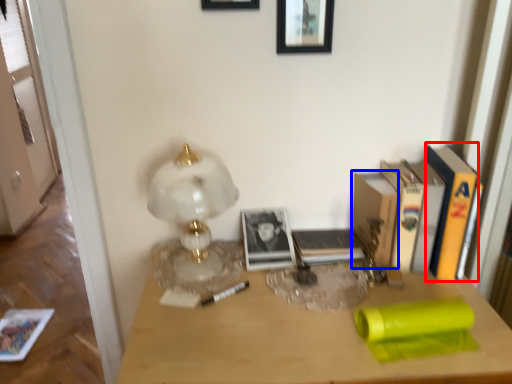
Question: Which of the following is the closest to the observer, paperback book (highlighted by a red box) or paperback book (highlighted by a blue box)?

Choices:
 (A) paperback book
 (B) paperback book

Answer: (A)